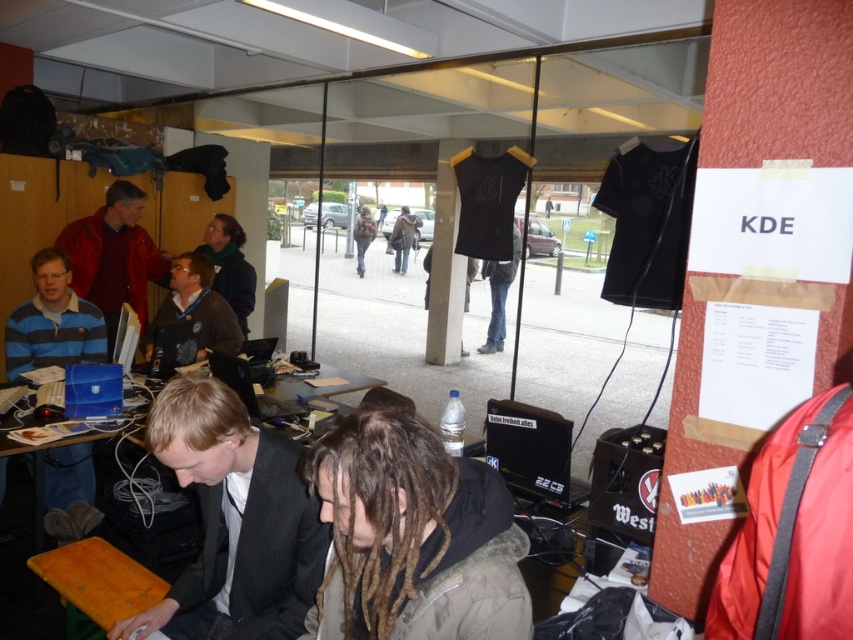
Who is shorter, dark gray suit at center or dark gray hoodie at center?

Standing shorter between the two is dark gray suit at center.

Between dark gray suit at center and dark gray hoodie at center, which one appears on the right side from the viewer's perspective?

From the viewer's perspective, dark gray suit at center appears more on the right side.

The image size is (853, 640). In order to click on dark gray suit at center in this screenshot , I will do `click(233, 522)`.

Describe the element at coordinates (412, 536) in the screenshot. I see `brown fuzzy jacket at lower center` at that location.

I want to click on brown fuzzy jacket at lower center, so click(x=412, y=536).

In the scene shown: Is dark gray jacket at center smaller than dark gray hoodie at center?

Yes, dark gray jacket at center is smaller than dark gray hoodie at center.

Looking at this image, is the position of dark gray jacket at center less distant than that of dark gray hoodie at center?

Yes, dark gray jacket at center is closer to the viewer.

Measure the distance between dark gray jacket at center and camera.

dark gray jacket at center is 11.96 meters away from camera.

At what (x,y) coordinates should I click in order to perform the action: click on dark gray jacket at center. Please return your answer as a coordinate pair (x, y). Looking at the image, I should click on (403, 237).